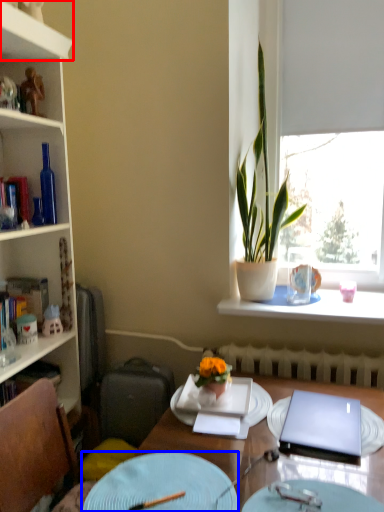
Question: Among these objects, which one is farthest to the camera, cabinet (highlighted by a red box) or plate (highlighted by a blue box)?

Choices:
 (A) cabinet
 (B) plate

Answer: (A)